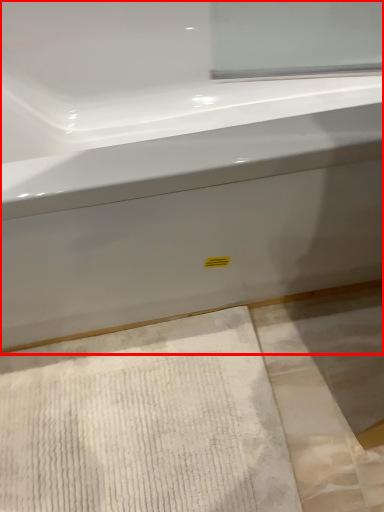
Question: Where is bathtub (annotated by the red box) located in relation to bath mat in the image?

Choices:
 (A) right
 (B) left

Answer: (A)